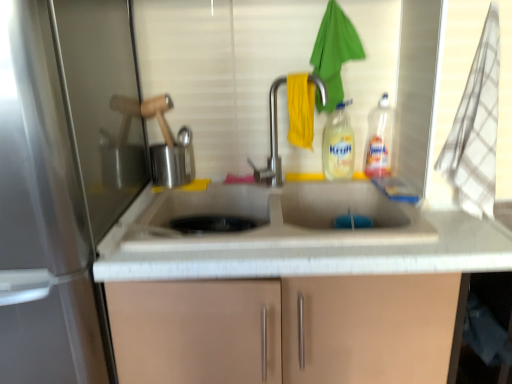
Locate an element on the screen. The width and height of the screenshot is (512, 384). brushed metal kettle at upper left is located at coordinates (173, 161).

You are a GUI agent. You are given a task and a screenshot of the screen. Output one action in this format:
    pyautogui.click(x=<x>, y=<y>)
    Task: Click on the yellow translucent liquid at center, the 1th bottle positioned from the left
    The width and height of the screenshot is (512, 384).
    Given the screenshot: What is the action you would take?
    pyautogui.click(x=338, y=145)

You are a GUI agent. You are given a task and a screenshot of the screen. Output one action in this format:
    pyautogui.click(x=<x>, y=<y>)
    Task: Click on the screen door that appears below the satin nickel faucet at center (from the image's perspective)
    This screenshot has width=512, height=384.
    Given the screenshot: What is the action you would take?
    pyautogui.click(x=41, y=222)

From a real-world perspective, is brushed metal screen door at left physically above satin nickel faucet at center?

Incorrect, from a real-world perspective, brushed metal screen door at left is lower than satin nickel faucet at center.

Is brushed metal screen door at left next to satin nickel faucet at center?

brushed metal screen door at left and satin nickel faucet at center are not in contact.

Is point (170, 169) less distant than point (20, 294)?

No, (170, 169) is further to viewer.

Is brushed metal kettle at upper left looking in the opposite direction of brushed metal screen door at left?

brushed metal kettle at upper left does not have its back to brushed metal screen door at left.

Where is `appliance that is above the brushed metal screen door at left (from the image's perspective)`? appliance that is above the brushed metal screen door at left (from the image's perspective) is located at coordinates (173, 161).

Is the position of brushed metal kettle at upper left more distant than that of brushed metal screen door at left?

That is True.

Is yellow translucent liquid at center, the second bottle positioned from the right, turned away from brushed metal screen door at left?

yellow translucent liquid at center, the second bottle positioned from the right, does not have its back to brushed metal screen door at left.

Is yellow translucent liquid at center, the 1th bottle positioned from the left, far away from brushed metal screen door at left?

yellow translucent liquid at center, the 1th bottle positioned from the left, is near brushed metal screen door at left, not far away.

Between point (342, 142) and point (28, 209), which one is positioned in front?

The point (28, 209) is closer.

Is yellow translucent liquid at center, the 1th bottle positioned from the left, behind brushed metal screen door at left?

Yes, it is.

Is point (349, 102) farther from camera compared to point (272, 186)?

Yes, point (349, 102) is behind point (272, 186).

Is yellow translucent liquid at center, the second bottle positioned from the right, bigger than satin nickel faucet at center?

No, yellow translucent liquid at center, the second bottle positioned from the right, is not bigger than satin nickel faucet at center.

Which is correct: yellow translucent liquid at center, the second bottle positioned from the right, is inside satin nickel faucet at center, or outside of it?

yellow translucent liquid at center, the second bottle positioned from the right, is located beyond the bounds of satin nickel faucet at center.

Considering the positions of objects yellow translucent liquid at center, the 1th bottle positioned from the left, and satin nickel faucet at center in the image provided, who is more to the left, yellow translucent liquid at center, the 1th bottle positioned from the left, or satin nickel faucet at center?

satin nickel faucet at center.

Considering the relative sizes of brushed metal screen door at left and translucent plastic bottle at upper right, positioned as the first bottle in right-to-left order, in the image provided, is brushed metal screen door at left shorter than translucent plastic bottle at upper right, positioned as the first bottle in right-to-left order,?

No, brushed metal screen door at left is not shorter than translucent plastic bottle at upper right, positioned as the first bottle in right-to-left order.

From the image's perspective, who appears lower, brushed metal screen door at left or translucent plastic bottle at upper right, positioned as the first bottle in right-to-left order?

brushed metal screen door at left appears lower in the image.

From a real-world perspective, who is located higher, brushed metal screen door at left or translucent plastic bottle at upper right, positioned as the first bottle in right-to-left order?

In real-world perspective, translucent plastic bottle at upper right, positioned as the first bottle in right-to-left order, is above.

The image size is (512, 384). Identify the location of screen door that appears on the left of translucent plastic bottle at upper right, marked as the second bottle in a left-to-right arrangement. (41, 222).

Is satin nickel faucet at center turned away from brushed metal screen door at left?

No, brushed metal screen door at left is not at the back of satin nickel faucet at center.

Can you confirm if satin nickel faucet at center is wider than brushed metal screen door at left?

In fact, satin nickel faucet at center might be narrower than brushed metal screen door at left.

How distant is satin nickel faucet at center from brushed metal screen door at left?

A distance of 28.39 inches exists between satin nickel faucet at center and brushed metal screen door at left.

Considering the relative sizes of satin nickel faucet at center and brushed metal screen door at left in the image provided, is satin nickel faucet at center shorter than brushed metal screen door at left?

Correct, satin nickel faucet at center is not as tall as brushed metal screen door at left.

How distant is yellow translucent liquid at center, the 1th bottle positioned from the left, from translucent plastic bottle at upper right, positioned as the first bottle in right-to-left order?

yellow translucent liquid at center, the 1th bottle positioned from the left, is 3.81 inches from translucent plastic bottle at upper right, positioned as the first bottle in right-to-left order.

What's the angular difference between yellow translucent liquid at center, the second bottle positioned from the right, and translucent plastic bottle at upper right, marked as the second bottle in a left-to-right arrangement,'s facing directions?

There is a 21.6-degree angle between the facing directions of yellow translucent liquid at center, the second bottle positioned from the right, and translucent plastic bottle at upper right, marked as the second bottle in a left-to-right arrangement.

From the image's perspective, is yellow translucent liquid at center, the second bottle positioned from the right, under translucent plastic bottle at upper right, marked as the second bottle in a left-to-right arrangement?

Yes, from the image's perspective, yellow translucent liquid at center, the second bottle positioned from the right, is below translucent plastic bottle at upper right, marked as the second bottle in a left-to-right arrangement.

Considering the points (353, 138) and (388, 155), which point is behind, point (353, 138) or point (388, 155)?

The point (388, 155) is farther.

Locate an element on the screen. Image resolution: width=512 pixels, height=384 pixels. screen door beneath the satin nickel faucet at center (from a real-world perspective) is located at coordinates [x=41, y=222].

The height and width of the screenshot is (384, 512). I want to click on appliance that appears above the brushed metal screen door at left (from the image's perspective), so click(173, 161).

Looking at the image, which one is located further to brushed metal kettle at upper left, satin nickel faucet at center or brushed metal screen door at left?

brushed metal screen door at left lies further to brushed metal kettle at upper left than the other object.

When comparing their distances from brushed metal screen door at left, does translucent plastic bottle at upper right, marked as the second bottle in a left-to-right arrangement, or yellow translucent liquid at center, the 1th bottle positioned from the left, seem closer?

yellow translucent liquid at center, the 1th bottle positioned from the left, is closer to brushed metal screen door at left.

From the image, which object appears to be nearer to yellow translucent liquid at center, the second bottle positioned from the right, translucent plastic bottle at upper right, marked as the second bottle in a left-to-right arrangement, or satin nickel faucet at center?

Based on the image, translucent plastic bottle at upper right, marked as the second bottle in a left-to-right arrangement, appears to be nearer to yellow translucent liquid at center, the second bottle positioned from the right.

Consider the image. When comparing their distances from translucent plastic bottle at upper right, marked as the second bottle in a left-to-right arrangement, does brushed metal screen door at left or yellow translucent liquid at center, the second bottle positioned from the right, seem further?

brushed metal screen door at left is positioned further to the anchor translucent plastic bottle at upper right, marked as the second bottle in a left-to-right arrangement.

From the image, which object appears to be farther from brushed metal kettle at upper left, brushed metal screen door at left or yellow translucent liquid at center, the 1th bottle positioned from the left?

Based on the image, brushed metal screen door at left appears to be further to brushed metal kettle at upper left.

Looking at the image, which one is located further to satin nickel faucet at center, translucent plastic bottle at upper right, marked as the second bottle in a left-to-right arrangement, or brushed metal kettle at upper left?

brushed metal kettle at upper left is further to satin nickel faucet at center.

When comparing their distances from translucent plastic bottle at upper right, positioned as the first bottle in right-to-left order, does brushed metal screen door at left or satin nickel faucet at center seem further?

brushed metal screen door at left is positioned further to the anchor translucent plastic bottle at upper right, positioned as the first bottle in right-to-left order.

Looking at the image, which one is located further to translucent plastic bottle at upper right, marked as the second bottle in a left-to-right arrangement, yellow translucent liquid at center, the second bottle positioned from the right, or satin nickel faucet at center?

Among the two, satin nickel faucet at center is located further to translucent plastic bottle at upper right, marked as the second bottle in a left-to-right arrangement.

This screenshot has width=512, height=384. I want to click on bottle between brushed metal screen door at left and translucent plastic bottle at upper right, positioned as the first bottle in right-to-left order, so click(338, 145).

Identify the location of bottle between brushed metal kettle at upper left and translucent plastic bottle at upper right, marked as the second bottle in a left-to-right arrangement. (338, 145).

Identify the location of tap located between brushed metal kettle at upper left and translucent plastic bottle at upper right, positioned as the first bottle in right-to-left order, in the left-right direction. This screenshot has width=512, height=384. (271, 143).

Find the location of a particular element. Image resolution: width=512 pixels, height=384 pixels. appliance between brushed metal screen door at left and translucent plastic bottle at upper right, marked as the second bottle in a left-to-right arrangement is located at coordinates (173, 161).